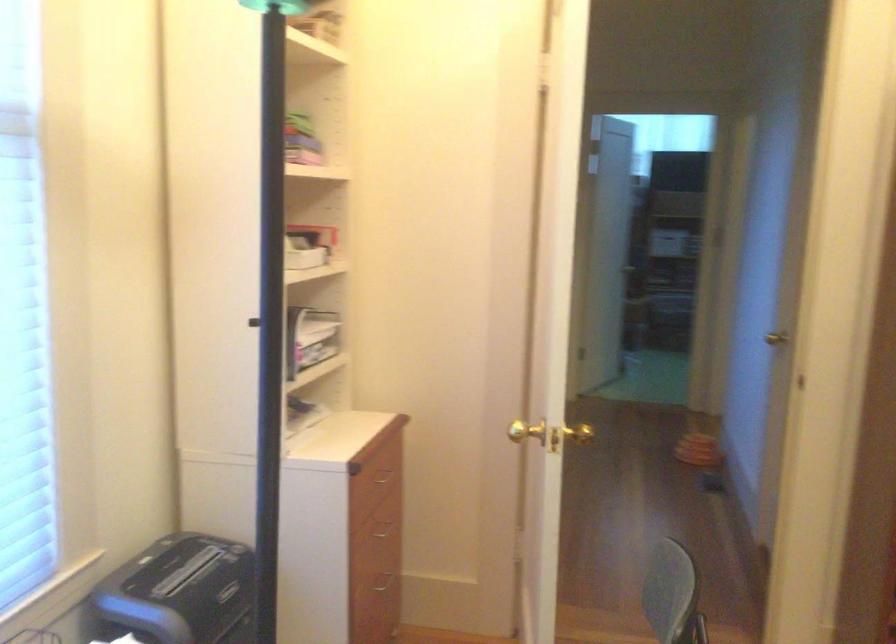
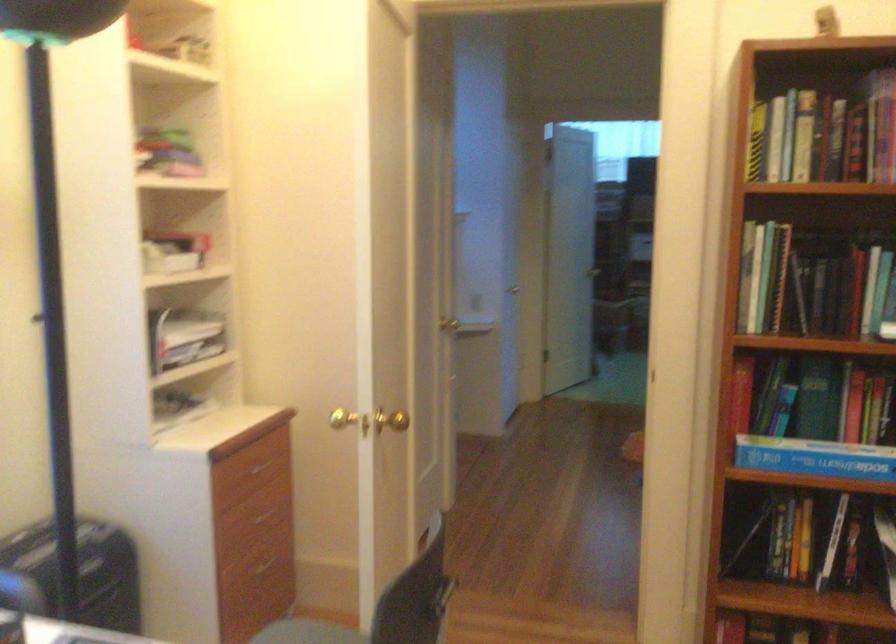
Question: Which direction would the cameraman need to move to produce the second image? Reply with the corresponding letter.

Choices:
 (A) Left
 (B) Right
 (C) Forward
 (D) Backward

Answer: (B)